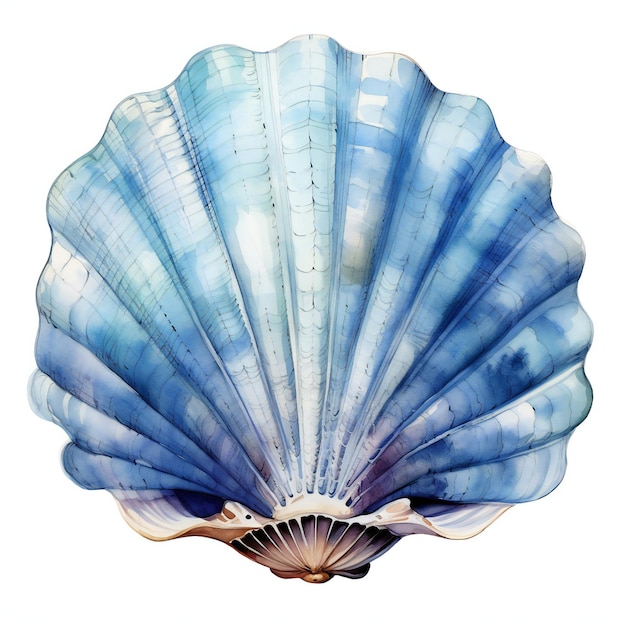
Locate an element on the screen. The height and width of the screenshot is (626, 626). hinge is located at coordinates (235, 536), (273, 525), (300, 514), (331, 514), (382, 535).